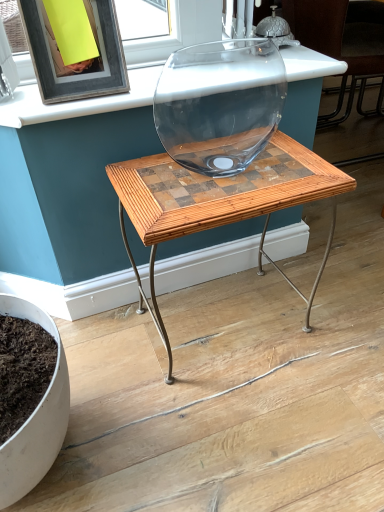
Identify the location of free space in front of wooden mosaic table at center. Image resolution: width=384 pixels, height=512 pixels. (251, 425).